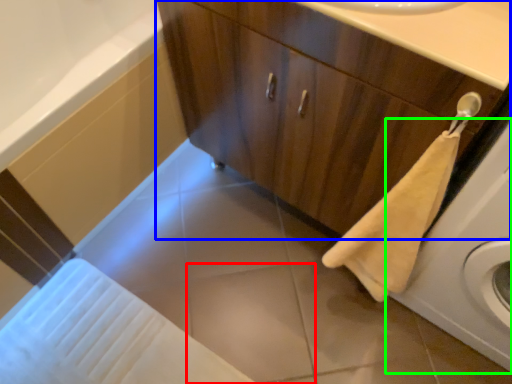
Question: Considering the real-world distances, which object is farthest from tile (highlighted by a red box)? bathroom cabinet (highlighted by a blue box) or washing machine (highlighted by a green box)?

Choices:
 (A) bathroom cabinet
 (B) washing machine

Answer: (A)